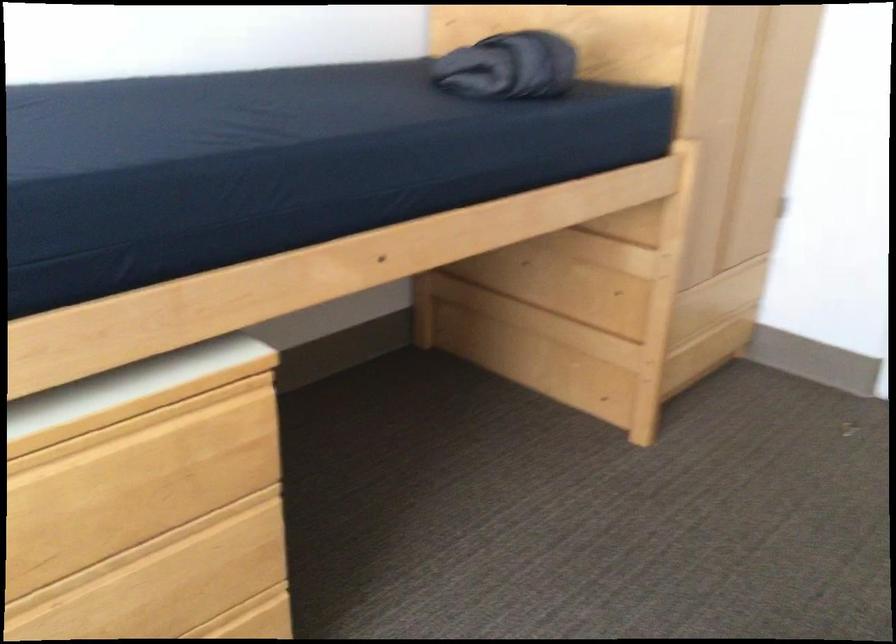
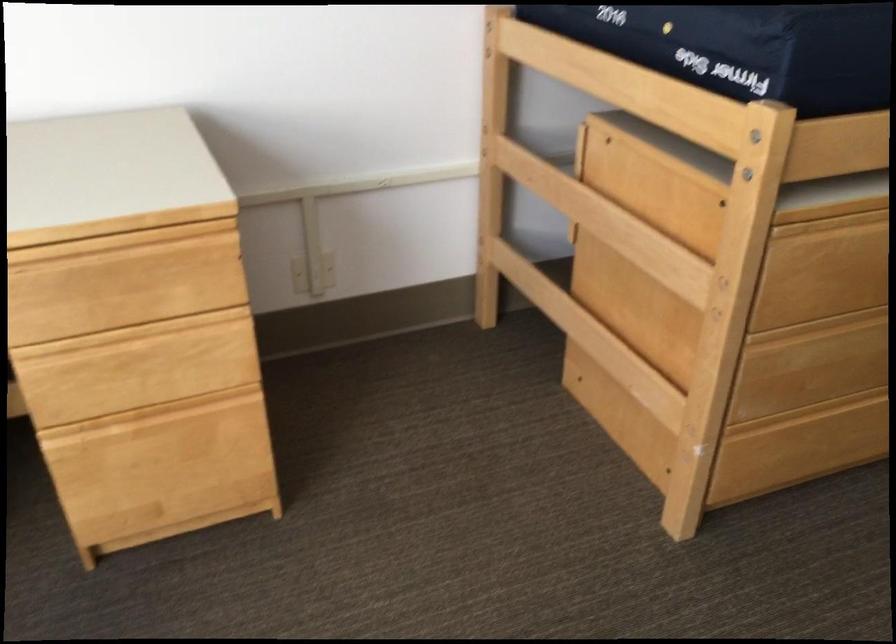
Which direction would the cameraman need to move to produce the second image?

The cameraman walked toward left, backward.